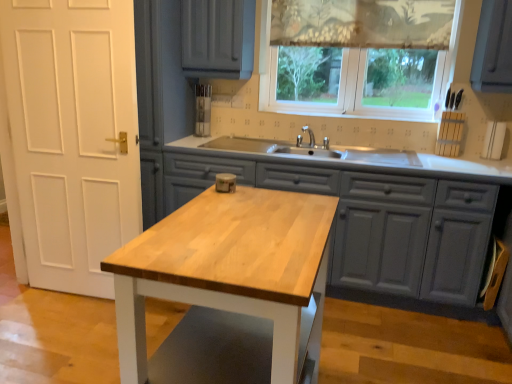
Find the location of a particular element. The height and width of the screenshot is (384, 512). blank space situated above light wood table at center (from a real-world perspective) is located at coordinates (236, 236).